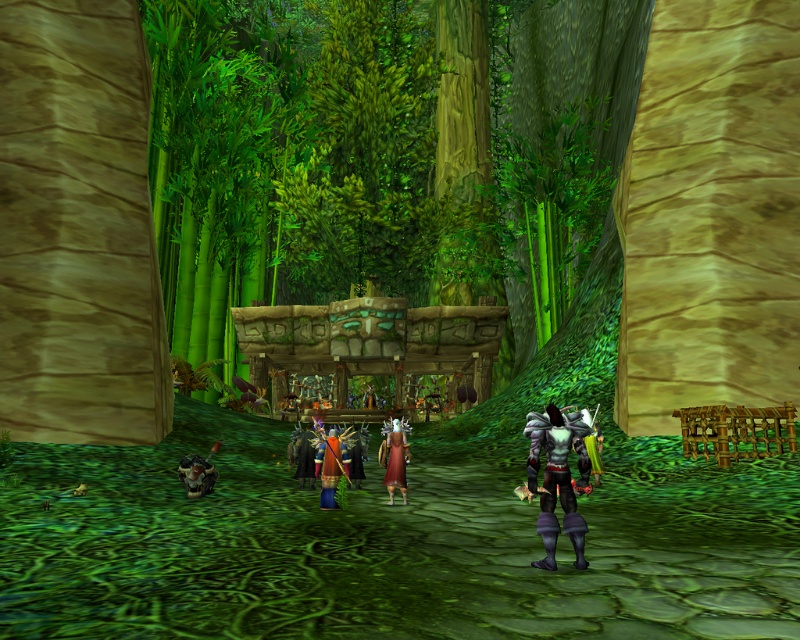
Measure the distance from shiny black armor at center to shiny orange armor at center.

shiny black armor at center is 2.41 meters away from shiny orange armor at center.

Can you confirm if shiny black armor at center is positioned below shiny orange armor at center?

Actually, shiny black armor at center is above shiny orange armor at center.

Identify the location of shiny black armor at center. This screenshot has width=800, height=640. (558, 477).

Is point (322, 464) positioned before point (404, 486)?

No, it is behind (404, 486).

Can you confirm if shiny orange armor at center is positioned above maroon velvet dress at center?

Incorrect, shiny orange armor at center is not positioned above maroon velvet dress at center.

What do you see at coordinates (330, 467) in the screenshot?
I see `shiny orange armor at center` at bounding box center [330, 467].

Locate an element on the screen. shiny orange armor at center is located at coordinates (330, 467).

Does shiny black armor at center have a lesser width compared to shiny blue armor at center?

No, shiny black armor at center is not thinner than shiny blue armor at center.

Between shiny black armor at center and shiny blue armor at center, which one is positioned lower?

shiny blue armor at center

Is point (568, 470) farther from viewer compared to point (294, 440)?

That is False.

You are a GUI agent. You are given a task and a screenshot of the screen. Output one action in this format:
    pyautogui.click(x=<x>, y=<y>)
    Task: Click on the shiny black armor at center
    
    Given the screenshot: What is the action you would take?
    pyautogui.click(x=558, y=477)